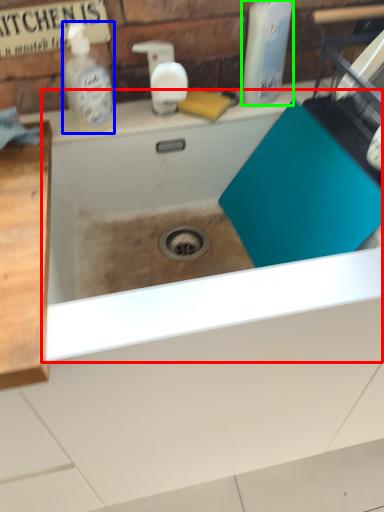
Question: Based on their relative distances, which object is nearer to bath (highlighted by a red box)? Choose from cleaning product (highlighted by a blue box) and cleaning product (highlighted by a green box).

Choices:
 (A) cleaning product
 (B) cleaning product

Answer: (A)